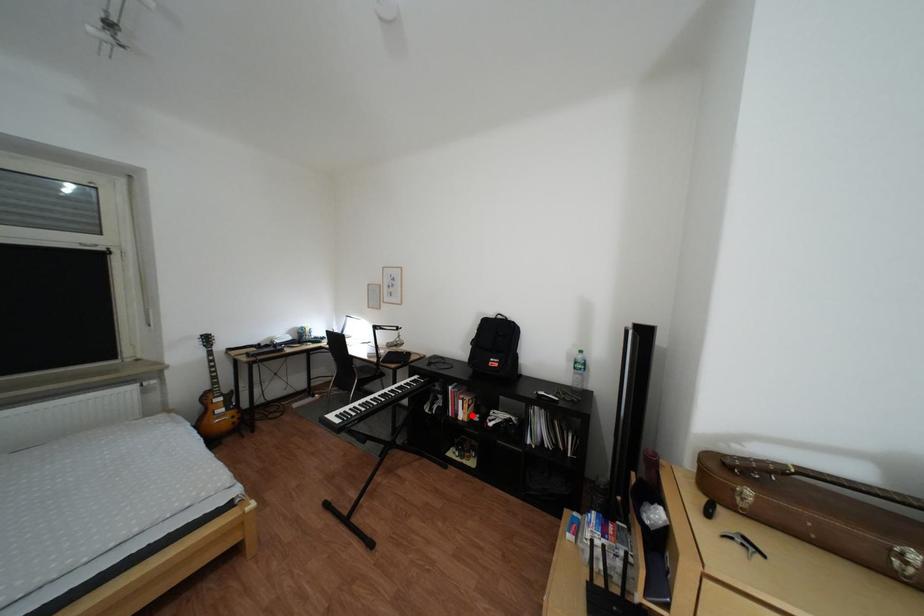
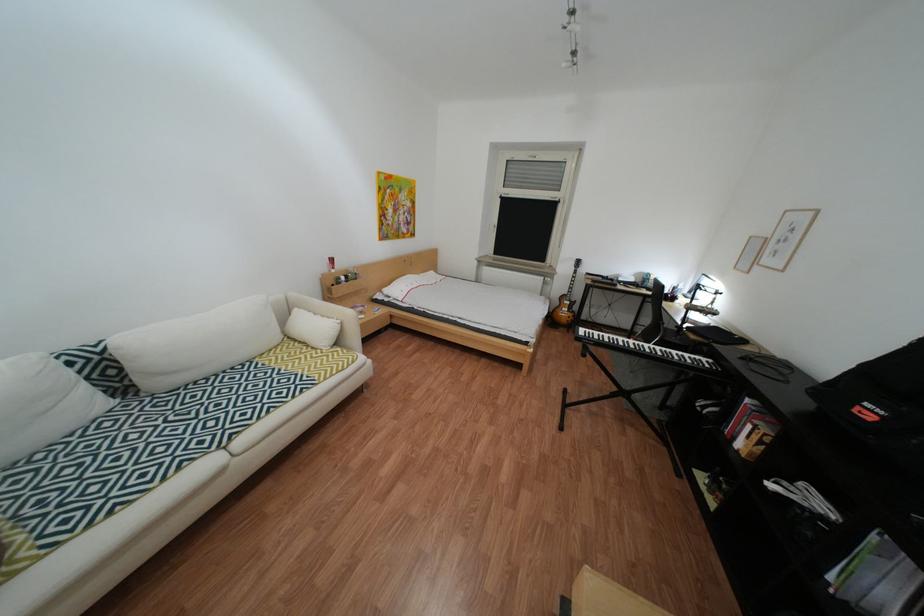
Question: A red point is marked in image1. In image2, is the corresponding 3D point closer to the camera or farther? Reply with the corresponding letter.

Choices:
 (A) The corresponding 3D point is closer.
 (B) The corresponding 3D point is farther.

Answer: (A)